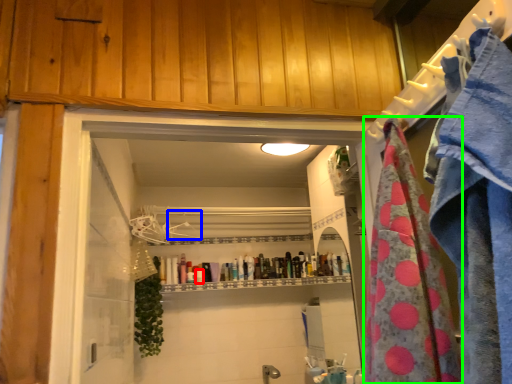
Question: Which object is the farthest from toiletry (highlighted by a red box)? Choose among these: hanger (highlighted by a blue box) or beach towel (highlighted by a green box).

Choices:
 (A) hanger
 (B) beach towel

Answer: (B)